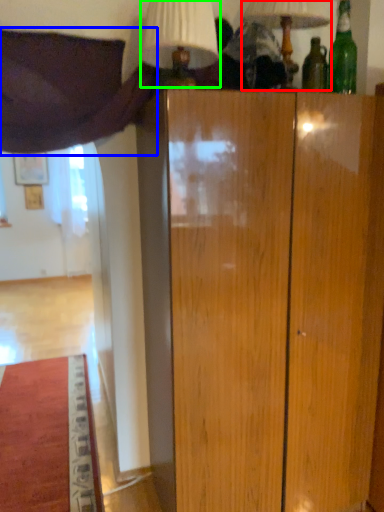
Question: Which is farther away from table lamp (highlighted by a red box)? curtain (highlighted by a blue box) or table lamp (highlighted by a green box)?

Choices:
 (A) curtain
 (B) table lamp

Answer: (A)